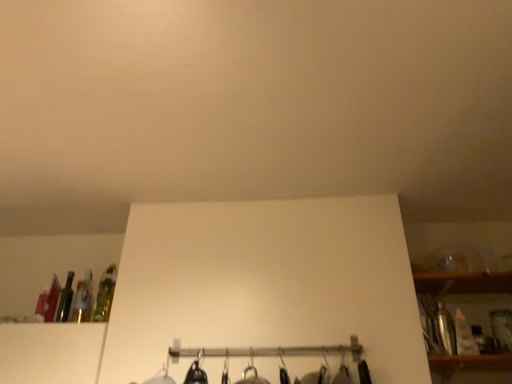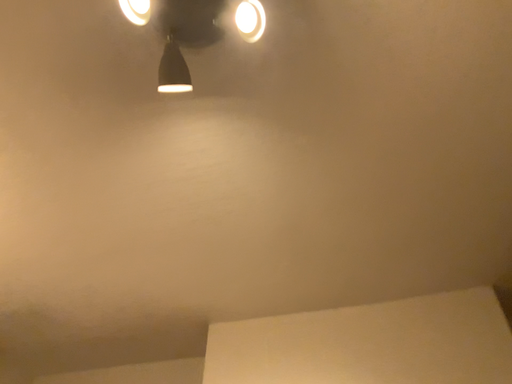
Question: Which way did the camera rotate in the video?

Choices:
 (A) rotated downward
 (B) rotated upward

Answer: (B)